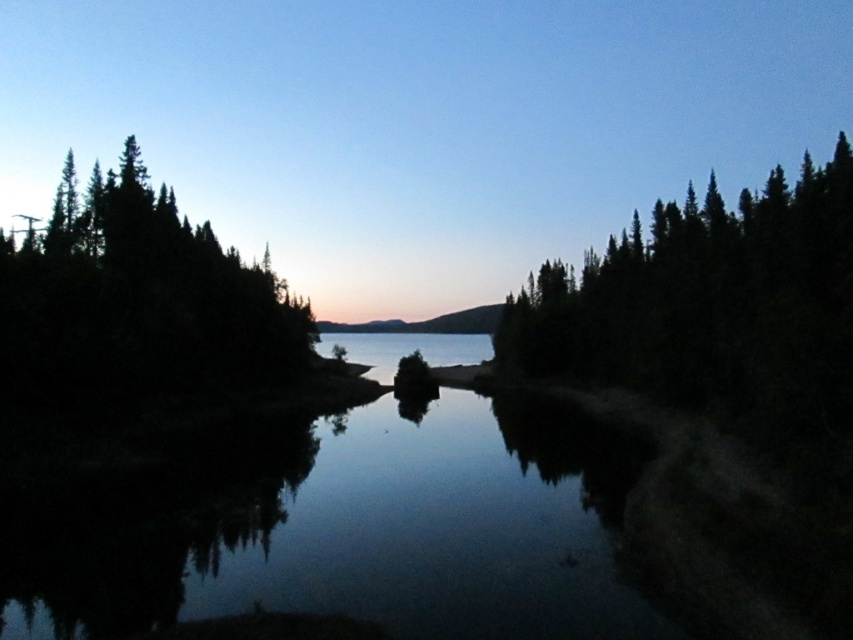
You are standing on the edge of the water and want to know which object, the dark green textured trees at right or the transparent glass water at center, is taller. Can you tell me?

The dark green textured trees at right has a greater height compared to transparent glass water at center, so the dark green textured trees at right is taller.

You are standing on the shore of the lake and see the dark green textured trees at left and the transparent glass water at center. Which object is positioned higher in the image?

The dark green textured trees at left are positioned above the transparent glass water at center in the image.